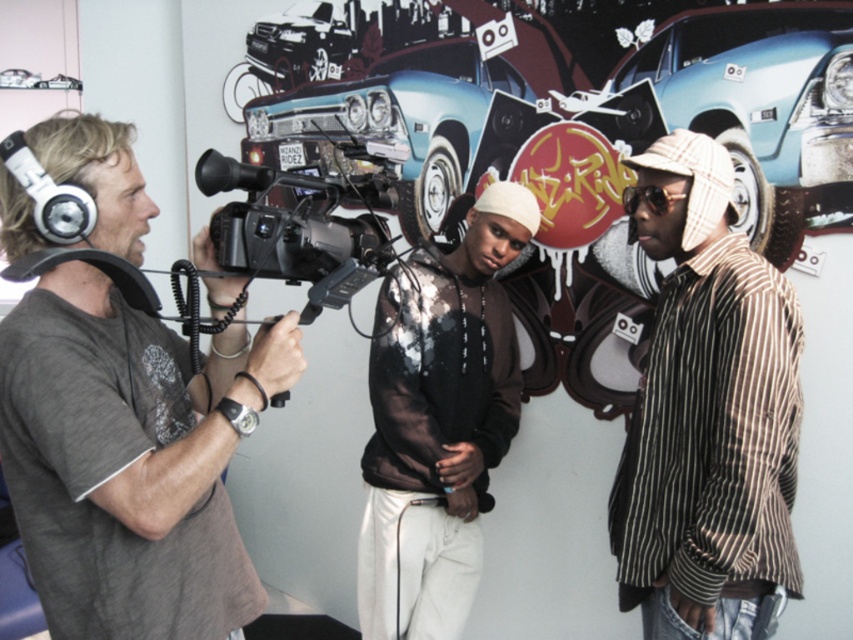
You are a photographer trying to capture the black sheer hoodie at center in the scene. You need to position yourself so that the point at coordinates (438,420) is directly in your camera frame. Where should you aim your camera to ensure the black sheer hoodie at center is centered?

The point at coordinates (438,420) marks the location of the black sheer hoodie at center, so aiming your camera at that coordinate will center the black sheer hoodie at center in your frame.